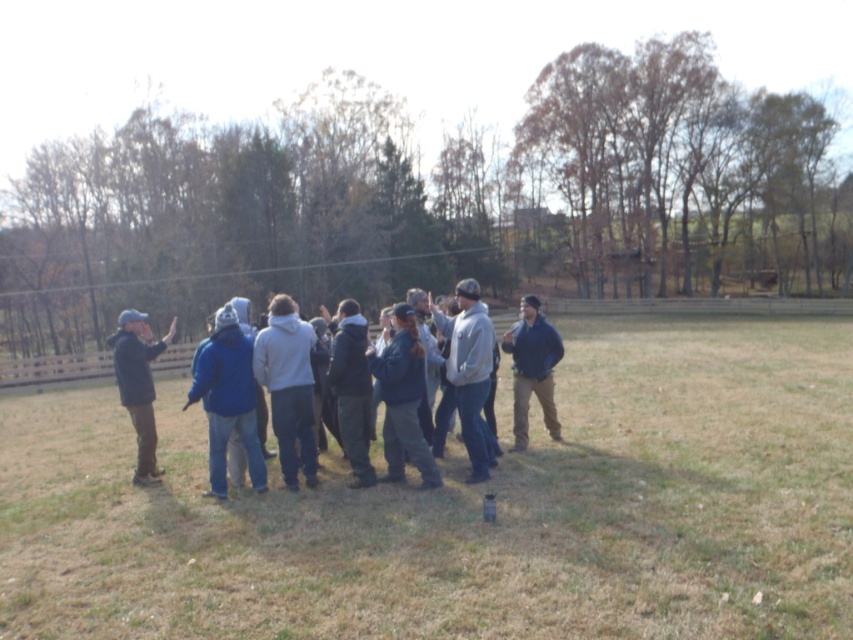
Can you confirm if white hoodie at center is thinner than gray fleece jacket at center?

Yes.

Image resolution: width=853 pixels, height=640 pixels. Describe the element at coordinates (288, 387) in the screenshot. I see `white hoodie at center` at that location.

Which is in front, point (277, 444) or point (457, 410)?

Positioned in front is point (457, 410).

Where is `white hoodie at center`? This screenshot has height=640, width=853. white hoodie at center is located at coordinates (288, 387).

Is gray fleece jacket at center further to camera compared to dark blue jacket at center?

Yes, gray fleece jacket at center is further from the viewer.

The height and width of the screenshot is (640, 853). Describe the element at coordinates (471, 372) in the screenshot. I see `gray fleece jacket at center` at that location.

Locate an element on the screen. gray fleece jacket at center is located at coordinates (471, 372).

Locate an element on the screen. This screenshot has width=853, height=640. gray fleece jacket at center is located at coordinates (471, 372).

Is white hoodie at center further to the viewer compared to blue jacket at center?

No, white hoodie at center is closer to the viewer.

Which is behind, point (296, 397) or point (515, 349)?

The point (515, 349) is behind.

Image resolution: width=853 pixels, height=640 pixels. I want to click on white hoodie at center, so click(x=288, y=387).